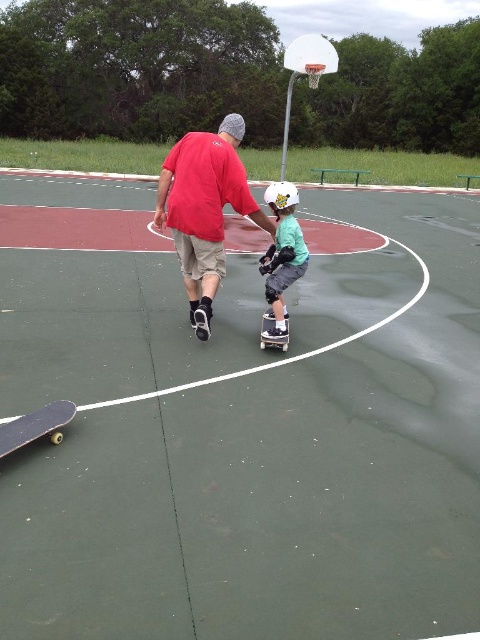
Question: Does matte red shirt at center have a greater width compared to black matte skateboard at center?

Choices:
 (A) no
 (B) yes

Answer: (B)

Question: Does white plastic basketball hoop at upper center appear over wooden skateboard at lower left?

Choices:
 (A) no
 (B) yes

Answer: (B)

Question: Among these points, which one is nearest to the camera?

Choices:
 (A) (294, 232)
 (B) (334, 52)
 (C) (271, 314)

Answer: (A)

Question: Which of the following is the closest to the observer?

Choices:
 (A) (275, 182)
 (B) (421, 358)

Answer: (B)

Question: Can you confirm if white plastic basketball hoop at upper center is positioned above wooden skateboard at lower left?

Choices:
 (A) no
 (B) yes

Answer: (B)

Question: Which object is closer to the camera taking this photo?

Choices:
 (A) green rubber court at center
 (B) black matte skateboard at center
 (C) white plastic basketball hoop at upper center

Answer: (A)